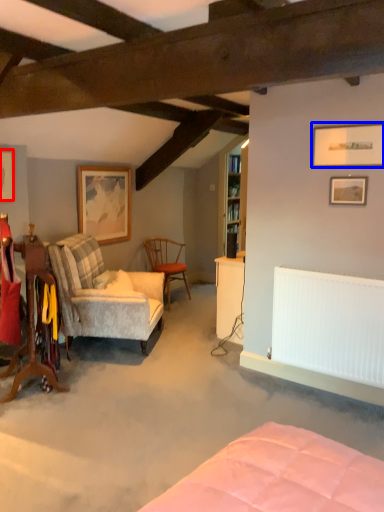
Question: Which object appears closest to the camera in this image, picture frame (highlighted by a red box) or picture frame (highlighted by a blue box)?

Choices:
 (A) picture frame
 (B) picture frame

Answer: (B)